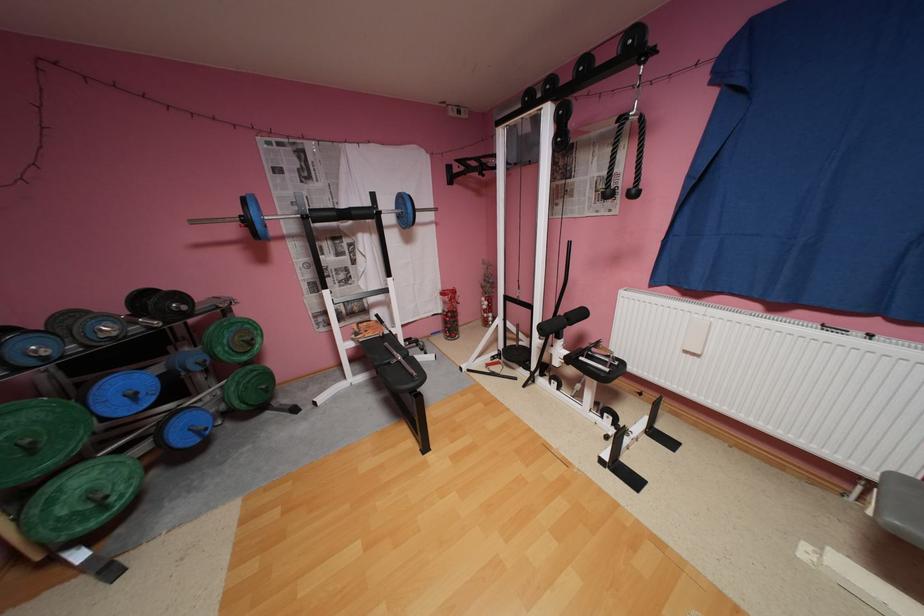
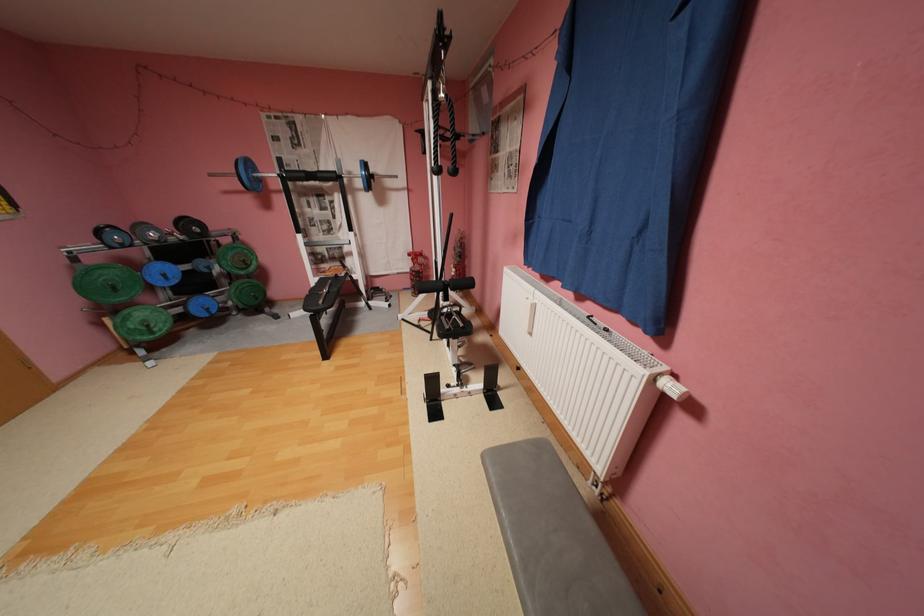
Question: The images are taken continuously from a first-person perspective. In which direction are you moving?

Choices:
 (A) Left
 (B) Right
 (C) Forward
 (D) Backward

Answer: (B)